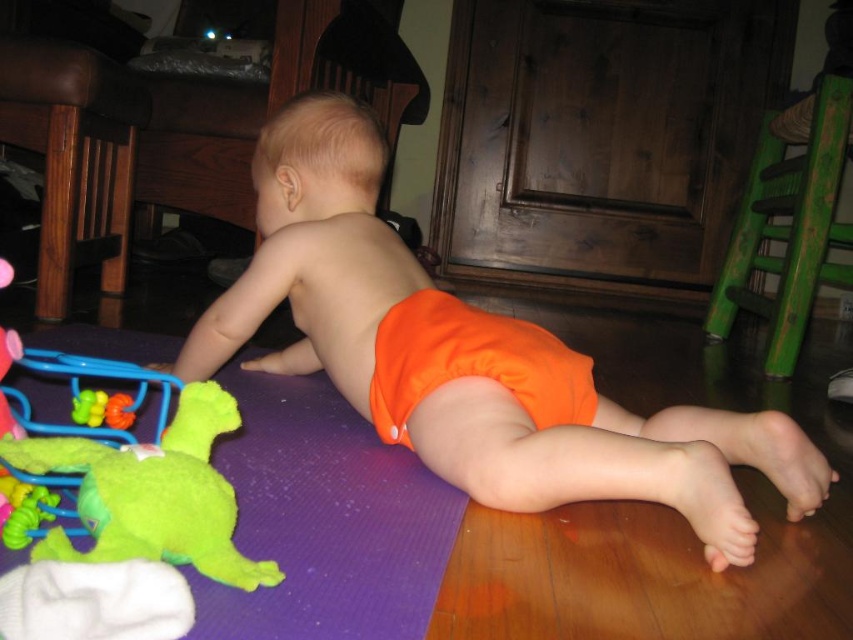
You are a photographer taking a picture of the baby crawling. You notice two points marked in the scene. The first point is at coordinate point (287, 179) and the second point is at coordinate point (230, 529). Which point is closer to the camera?

Point (287, 179) is further to the camera than point (230, 529), so the second point is closer to the camera.

The baby is playing with two items in the scene. One is the orange fabric diaper at center and the other is the green fuzzy toy at lower left. Which item is larger in size?

The orange fabric diaper at center is bigger than the green fuzzy toy at lower left.

The baby is crawling towards a toy. Which direction should the baby move to reach the orange fabric diaper at center from the green fuzzy toy at lower left?

The baby should move to the right to reach the orange fabric diaper at center since it is located to the right of the green fuzzy toy at lower left.